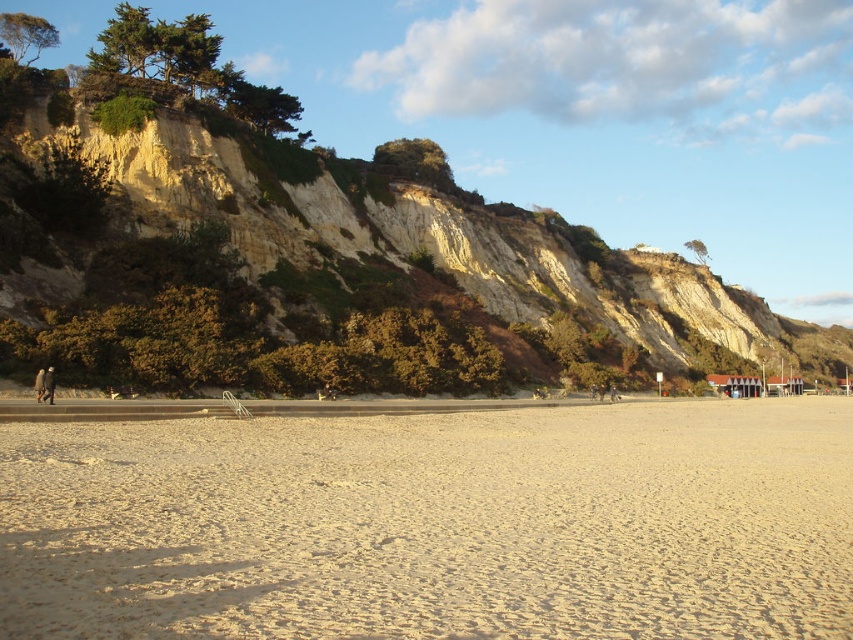
Between point (51, 394) and point (44, 394), which one is positioned behind?

Point (44, 394)

Does light brown leather jacket at lower left have a larger size compared to brown wool coat at left?

Yes, light brown leather jacket at lower left is bigger than brown wool coat at left.

Measure the distance between point (49, 374) and camera.

A distance of 57.54 meters exists between point (49, 374) and camera.

Identify the location of light brown leather jacket at lower left. Image resolution: width=853 pixels, height=640 pixels. (48, 385).

Does beige sandy beach at lower center have a greater height compared to brown wool coat at left?

Correct, beige sandy beach at lower center is much taller as brown wool coat at left.

Which is in front, point (502, 529) or point (38, 388)?

Point (502, 529) is in front.

Between point (392, 608) and point (41, 371), which one is positioned in front?

Point (392, 608) is in front.

Where is `beige sandy beach at lower center`? beige sandy beach at lower center is located at coordinates (434, 524).

Who is lower down, brown rocky cliff at upper left or light brown leather jacket at lower left?

Positioned lower is light brown leather jacket at lower left.

Does point (64, 204) come closer to viewer compared to point (48, 396)?

That is False.

Locate an element on the screen. Image resolution: width=853 pixels, height=640 pixels. brown rocky cliff at upper left is located at coordinates (322, 268).